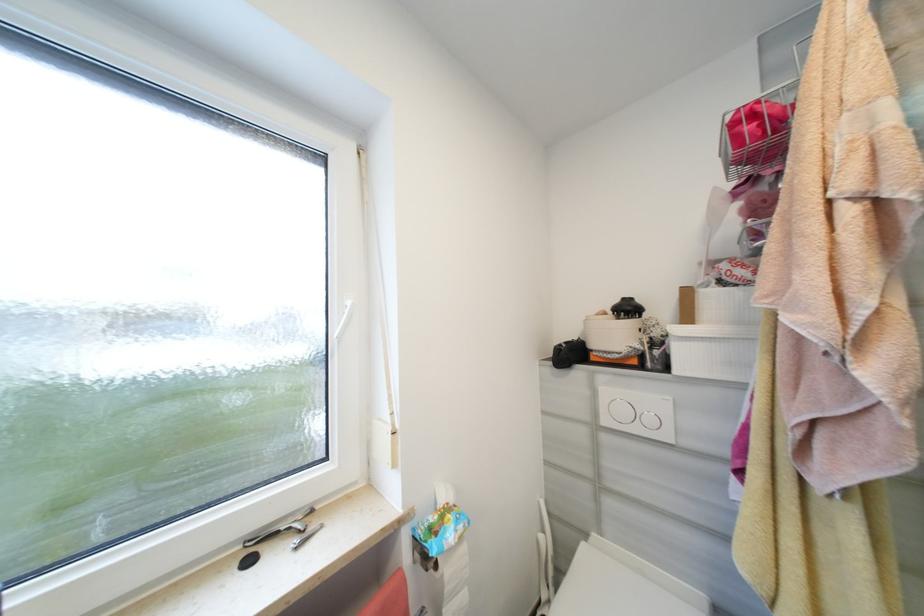
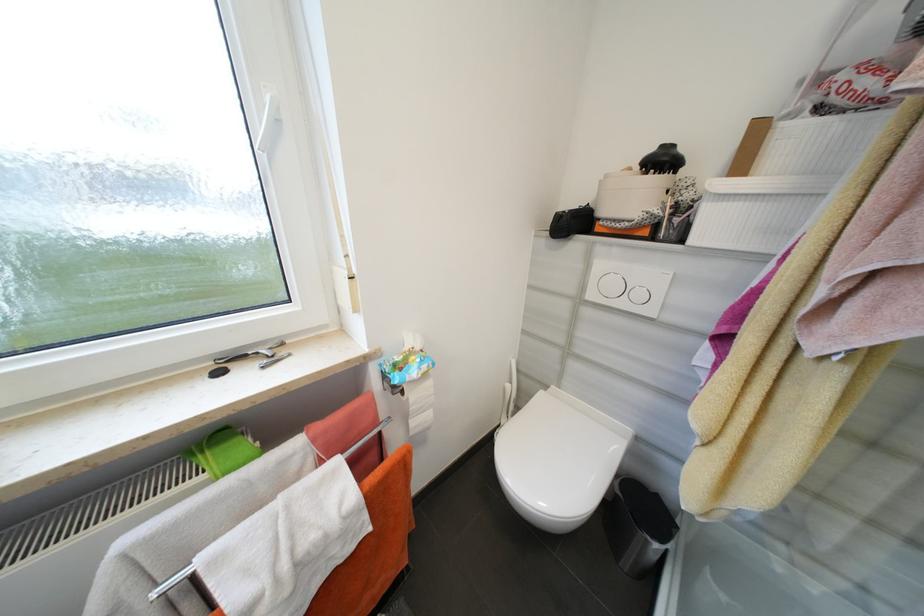
Locate, in the second image, the point that corresponds to point 467,529 in the first image.

(430, 368)